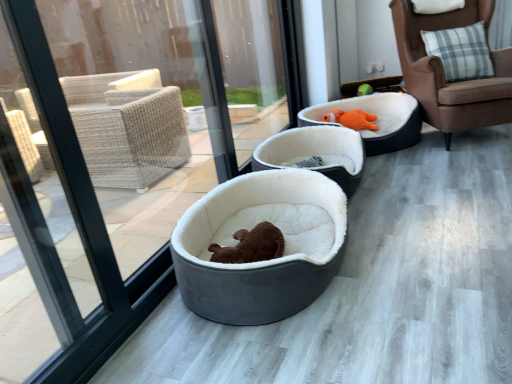
Question: Is soft white fur bed at center, acting as the second dog bed starting from the front, spatially inside velvet orange plush bed at center, acting as the 1th dog bed starting from the back, or outside of it?

Choices:
 (A) outside
 (B) inside

Answer: (A)

Question: Considering the positions of soft white fur bed at center, positioned as the 2th dog bed in back-to-front order, and velvet orange plush bed at center, which is the third dog bed in front-to-back order, in the image, is soft white fur bed at center, positioned as the 2th dog bed in back-to-front order, wider or thinner than velvet orange plush bed at center, which is the third dog bed in front-to-back order,?

Choices:
 (A) thin
 (B) wide

Answer: (A)

Question: Estimate the real-world distances between objects in this image. Which object is closer to the soft white fur bed at center, acting as the second dog bed starting from the front?

Choices:
 (A) velvet orange plush bed at center, which is the third dog bed in front-to-back order
 (B) brown leather chair at right
 (C) velvet gray dog bed at center, which ranks as the 1th dog bed in front-to-back order
 (D) orange plush toy at upper right

Answer: (A)

Question: Considering the real-world distances, which object is closest to the velvet gray dog bed at center, which ranks as the 1th dog bed in front-to-back order?

Choices:
 (A) soft white fur bed at center, positioned as the 2th dog bed in back-to-front order
 (B) brown leather chair at right
 (C) velvet orange plush bed at center, which is the third dog bed in front-to-back order
 (D) orange plush toy at upper right

Answer: (A)